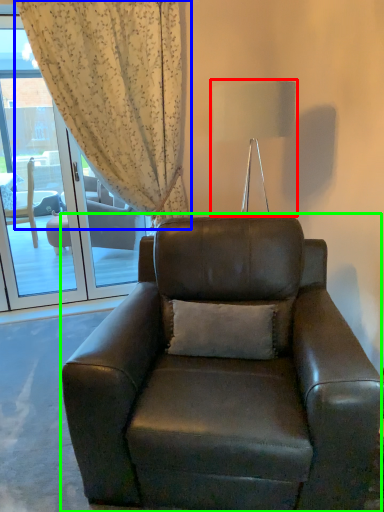
Question: Which object is positioned closest to lamp (highlighted by a red box)? Select from curtain (highlighted by a blue box) and chair (highlighted by a green box).

Choices:
 (A) curtain
 (B) chair

Answer: (A)